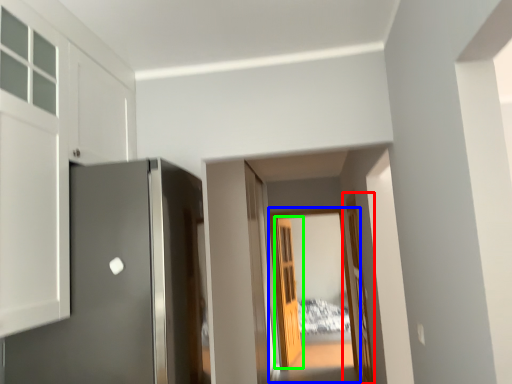
Question: Which object is positioned closest to door (highlighted by a red box)? Select from glass door (highlighted by a blue box) and door (highlighted by a green box).

Choices:
 (A) glass door
 (B) door

Answer: (A)